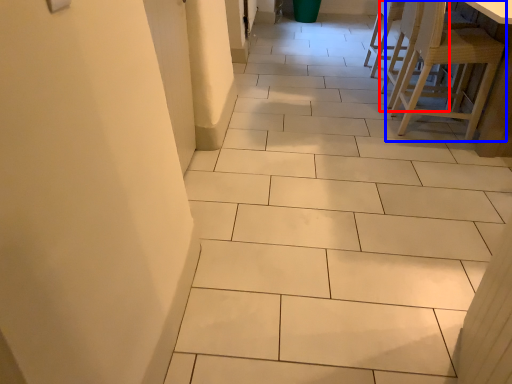
Question: Which of the following is the farthest to the observer, chair (highlighted by a red box) or chair (highlighted by a blue box)?

Choices:
 (A) chair
 (B) chair

Answer: (A)